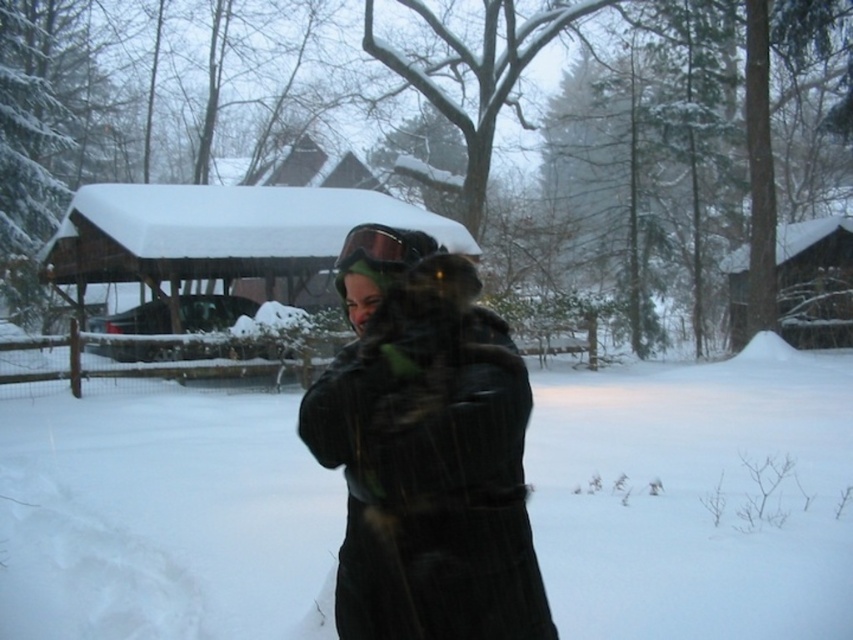
You are a visitor at this winter scene and want to take a photo of the wooden cabin at center and green matte goggles at center. Since you want to include both in the frame, which object should you zoom in on to ensure both are visible?

The wooden cabin at center is larger in size than green matte goggles at center, so you should zoom in on the wooden cabin at center to ensure both are visible.

You are planning to build a snowman using the white fluffy snow at center. The wooden cabin at center is in the way. How much space do you need to move the cabin to the right to make room for the snowman?

The white fluffy snow at center is wider than the wooden cabin at center, so you need to move the cabin to the right by the difference in their widths to create enough space for the snowman.